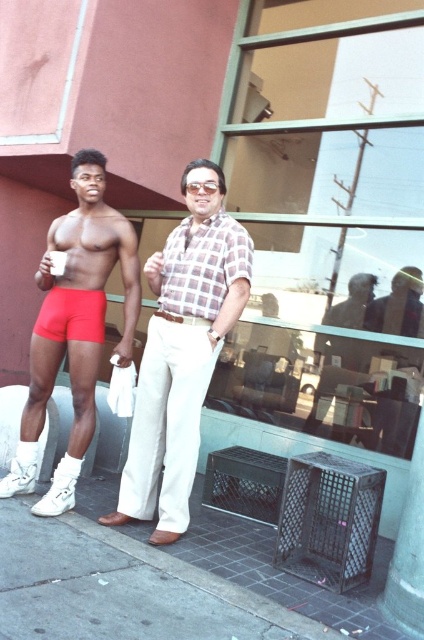
You are a fashion designer observing two outfits in the image. The first outfit has matte red shorts at center and the second has a checkered fabric shirt at center. Which of these two items appears taller in the image?

The matte red shorts at center appears taller than the checkered fabric shirt at center in the image.

You are standing in front of the building and want to place a small potted plant exactly where the gray concrete curb at lower left is located. What are the coordinates where you should place the plant?

The coordinates for placing the small potted plant should be at point (x=204, y=580), as that is the 2D location of the gray concrete curb at lower left.

You are a photographer trying to capture a photo of the matte red shorts at center and the checkered fabric shirt at center. Based on their positions, which object should you focus on first if you want to include both in your frame without moving the camera?

The matte red shorts at center should be focused on first since it is positioned on the left side of the checkered fabric shirt at center, so adjusting the frame to include the leftmost object ensures both are captured.